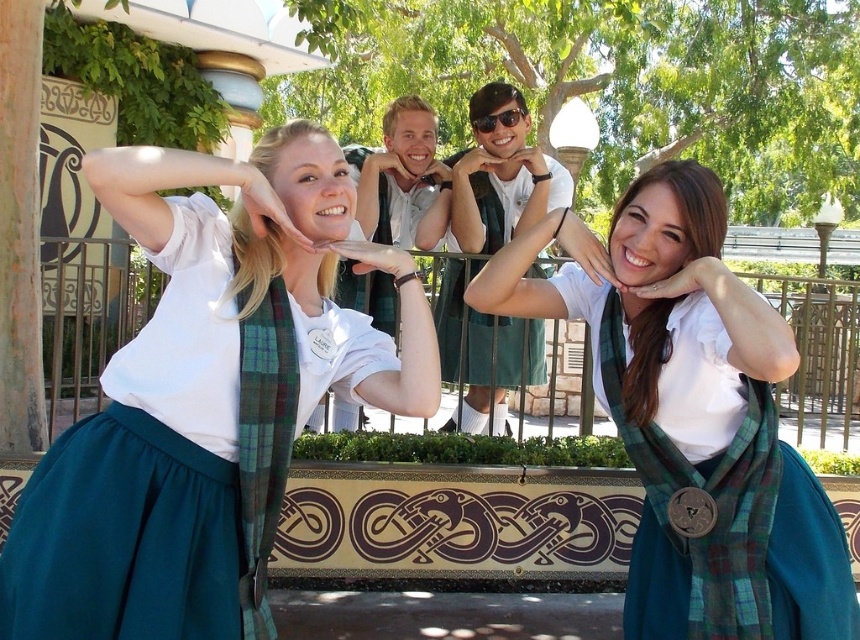
Question: Which object appears farthest from the camera in this image?

Choices:
 (A) green plaid scarf at center
 (B) plaid fabric scarf at center
 (C) matte green skirt at center
 (D) matte green scarf at center

Answer: (C)

Question: Which object is the farthest from the matte green scarf at center?

Choices:
 (A) green plaid scarf at center
 (B) plaid fabric scarf at center
 (C) white cotton shirt at center

Answer: (C)

Question: Does green plaid scarf at center have a greater width compared to white cotton shirt at center?

Choices:
 (A) yes
 (B) no

Answer: (A)

Question: Is matte green skirt at center in front of white cotton shirt at center?

Choices:
 (A) no
 (B) yes

Answer: (B)

Question: Is the position of matte green skirt at center less distant than that of matte green scarf at center?

Choices:
 (A) no
 (B) yes

Answer: (A)

Question: Which of the following is the closest to the observer?

Choices:
 (A) (378, 273)
 (B) (302, 337)

Answer: (B)